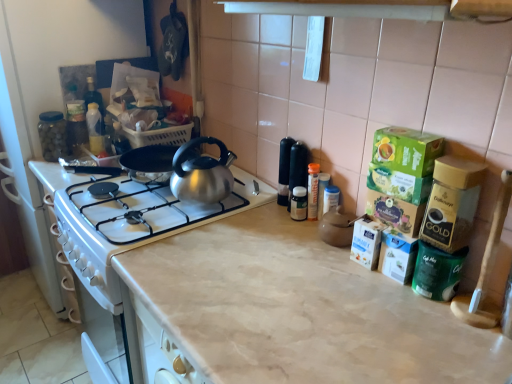
Question: Is green matte coffee container at right, positioned as the 1th appliance in bottom-to-top order, taller than transparent glass jar at left, positioned as the 2th appliance in bottom-to-top order?

Choices:
 (A) yes
 (B) no

Answer: (B)

Question: Is the position of green matte coffee container at right, which is counted as the 1th appliance, starting from the front, more distant than that of transparent glass jar at left, placed as the first appliance when sorted from left to right?

Choices:
 (A) yes
 (B) no

Answer: (B)

Question: Does green matte coffee container at right, which appears as the second appliance when viewed from the back, have a lesser height compared to transparent glass jar at left, placed as the first appliance when sorted from left to right?

Choices:
 (A) no
 (B) yes

Answer: (B)

Question: Considering the relative sizes of green matte coffee container at right, which ranks as the 2th appliance in left-to-right order, and transparent glass jar at left, positioned as the 2th appliance in bottom-to-top order, in the image provided, is green matte coffee container at right, which ranks as the 2th appliance in left-to-right order, wider than transparent glass jar at left, positioned as the 2th appliance in bottom-to-top order,?

Choices:
 (A) yes
 (B) no

Answer: (A)

Question: From a real-world perspective, is green matte coffee container at right, which is counted as the 1th appliance, starting from the front, located higher than transparent glass jar at left, the 1th appliance when ordered from back to front?

Choices:
 (A) no
 (B) yes

Answer: (A)

Question: Is green matte coffee container at right, the 2th appliance positioned from the top, not close to transparent glass jar at left, placed as the first appliance when sorted from left to right?

Choices:
 (A) yes
 (B) no

Answer: (A)

Question: Does transparent glass jar at left, which ranks as the 2th appliance in right-to-left order, appear on the left side of beige marble countertop at center?

Choices:
 (A) yes
 (B) no

Answer: (A)

Question: Is beige marble countertop at center a part of transparent glass jar at left, placed as the first appliance when sorted from left to right?

Choices:
 (A) yes
 (B) no

Answer: (B)

Question: Is transparent glass jar at left, the second appliance positioned from the front, not close to beige marble countertop at center?

Choices:
 (A) yes
 (B) no

Answer: (A)

Question: From the image's perspective, does transparent glass jar at left, which ranks as the 2th appliance in right-to-left order, appear lower than beige marble countertop at center?

Choices:
 (A) no
 (B) yes

Answer: (A)

Question: Is transparent glass jar at left, positioned as the 2th appliance in bottom-to-top order, outside beige marble countertop at center?

Choices:
 (A) yes
 (B) no

Answer: (A)

Question: Is transparent glass jar at left, the 1th appliance when ordered from back to front, taller than beige marble countertop at center?

Choices:
 (A) no
 (B) yes

Answer: (A)

Question: Does transparent glass jar at left, positioned as the 2th appliance in bottom-to-top order, have a lesser width compared to green matte coffee container at right, which appears as the second appliance when viewed from the back?

Choices:
 (A) no
 (B) yes

Answer: (B)